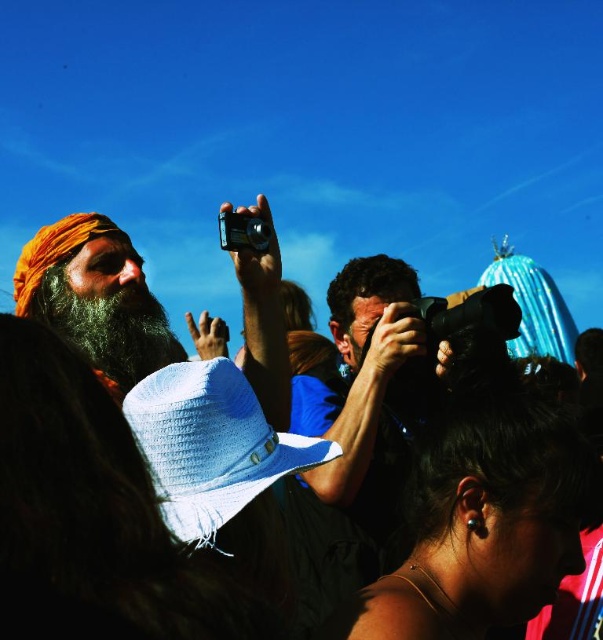
Question: Considering the relative positions of matte orange turban at upper left and grayish-black beard at left in the image provided, where is matte orange turban at upper left located with respect to grayish-black beard at left?

Choices:
 (A) below
 (B) above

Answer: (B)

Question: Among these points, which one is farthest from the camera?

Choices:
 (A) (162, 314)
 (B) (150, 356)

Answer: (A)

Question: Does matte orange turban at upper left appear on the left side of grayish-black beard at left?

Choices:
 (A) no
 (B) yes

Answer: (A)

Question: Among these objects, which one is nearest to the camera?

Choices:
 (A) grayish-black beard at left
 (B) matte orange turban at upper left

Answer: (A)

Question: Which of the following is the farthest from the observer?

Choices:
 (A) matte orange turban at upper left
 (B) grayish-black beard at left

Answer: (A)

Question: Is matte orange turban at upper left smaller than grayish-black beard at left?

Choices:
 (A) no
 (B) yes

Answer: (A)